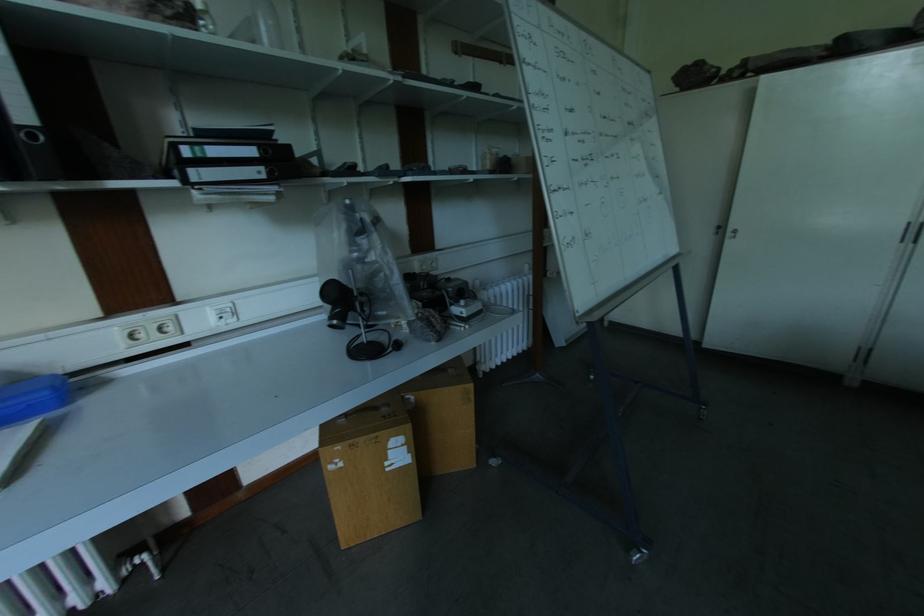
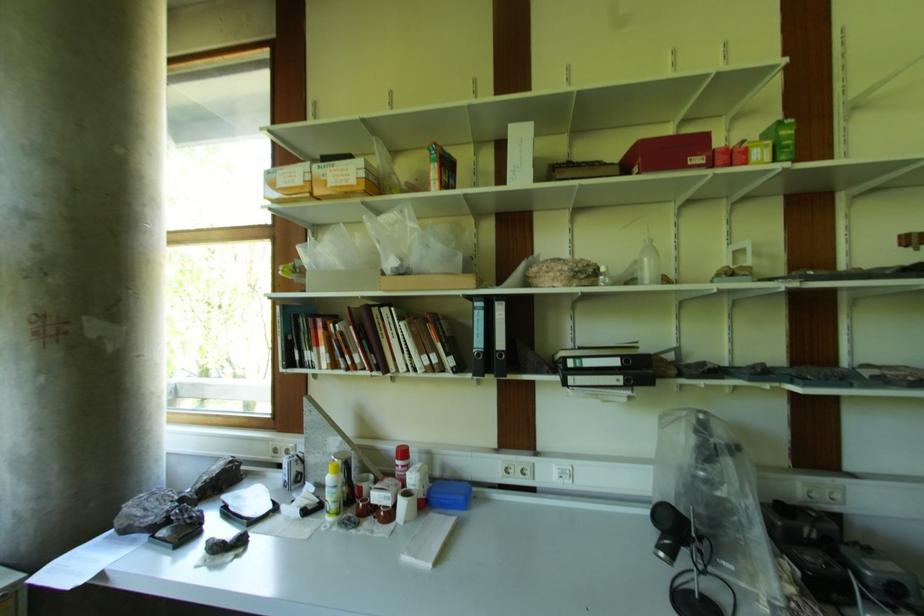
Question: The camera is either moving clockwise (left) or counter-clockwise (right) around the object. The first image is from the beginning of the video and the second image is from the end. Is the camera moving left or right when shooting the video?

Choices:
 (A) Left
 (B) Right

Answer: (B)